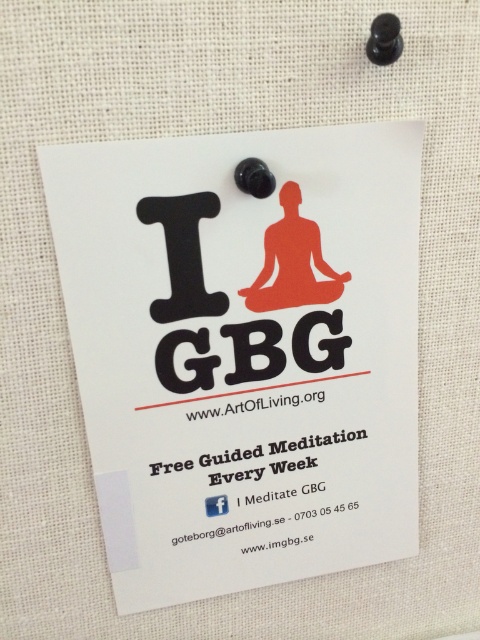
Question: Which point is closer to the camera taking this photo?

Choices:
 (A) (216, 504)
 (B) (166, 284)

Answer: (B)

Question: Is white paper poster at center to the left of white matte facebook logo at center from the viewer's perspective?

Choices:
 (A) no
 (B) yes

Answer: (A)

Question: Which point is closer to the camera?

Choices:
 (A) white matte facebook logo at center
 (B) white paper poster at center

Answer: (B)

Question: Does white paper poster at center have a greater width compared to white matte facebook logo at center?

Choices:
 (A) no
 (B) yes

Answer: (B)

Question: Which object is closer to the camera taking this photo?

Choices:
 (A) white paper poster at center
 (B) white matte facebook logo at center

Answer: (A)

Question: Does white paper poster at center have a greater width compared to white matte facebook logo at center?

Choices:
 (A) no
 (B) yes

Answer: (B)